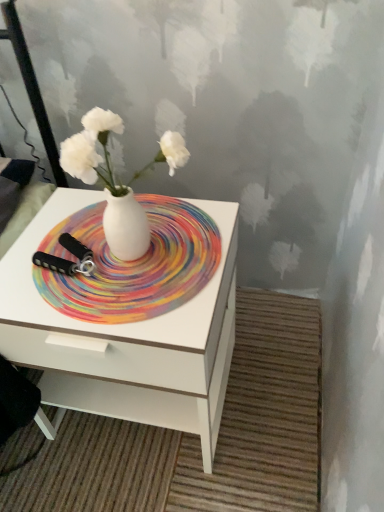
Locate an element on the screen. Image resolution: width=384 pixels, height=512 pixels. vacant space situated on the left part of white glossy vase at center is located at coordinates (54, 267).